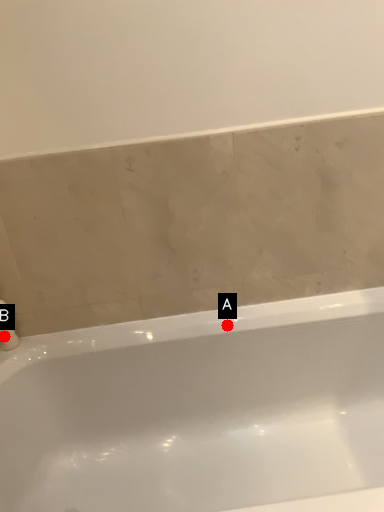
Question: Two points are circled on the image, labeled by A and B beside each circle. Which point is further to the camera?

Choices:
 (A) A is further
 (B) B is further

Answer: (A)